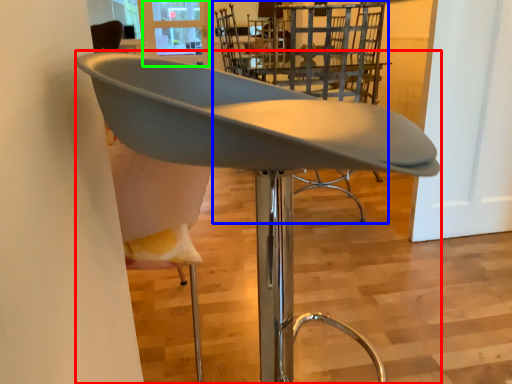
Question: Which is farther away from chair (highlighted by a red box)? chair (highlighted by a blue box) or window screen (highlighted by a green box)?

Choices:
 (A) chair
 (B) window screen

Answer: (B)